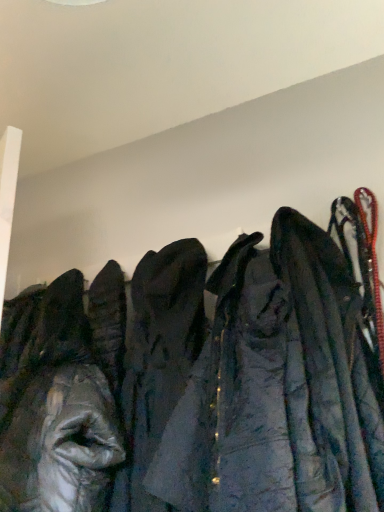
What is the approximate height of dark blue fabric coat at right, which is the 1th cloak in right-to-left order?

The height of dark blue fabric coat at right, which is the 1th cloak in right-to-left order, is 78.36 centimeters.

In the scene shown: In order to face dark gray fabric coat at center, which appears as the 1th cloak when viewed from the left, should I rotate leftwards or rightwards?

You should rotate left by 4.599 degrees.

Locate an element on the screen. This screenshot has width=384, height=512. dark blue fabric coat at right, which is counted as the second cloak, starting from the left is located at coordinates (332, 360).

Is point (314, 291) closer or farther from the camera than point (134, 367)?

Point (314, 291).

Based on the photo, how many degrees apart are the facing directions of dark blue fabric coat at right, which is the 1th cloak in right-to-left order, and dark gray fabric coat at center, which is the second cloak from right to left?

The angle between the facing direction of dark blue fabric coat at right, which is the 1th cloak in right-to-left order, and the facing direction of dark gray fabric coat at center, which is the second cloak from right to left, is 0.000334 degrees.

Is dark blue fabric coat at right, which is the 1th cloak in right-to-left order, aimed at dark gray fabric coat at center, which is the second cloak from right to left?

No.

Which of these two, dark blue fabric coat at right, which is counted as the second cloak, starting from the left, or dark gray fabric coat at center, which appears as the 1th cloak when viewed from the left, is bigger?

dark blue fabric coat at right, which is counted as the second cloak, starting from the left, is bigger.

Is dark blue fabric coat at right, which is the 1th cloak in right-to-left order, positioned beyond the bounds of shiny silver jacket at left?

That's correct, dark blue fabric coat at right, which is the 1th cloak in right-to-left order, is outside of shiny silver jacket at left.

How different are the orientations of dark blue fabric coat at right, which is counted as the second cloak, starting from the left, and shiny silver jacket at left in degrees?

The angular difference between dark blue fabric coat at right, which is counted as the second cloak, starting from the left, and shiny silver jacket at left is 0.000925 degrees.

From the image's perspective, is dark blue fabric coat at right, which is the 1th cloak in right-to-left order, on shiny silver jacket at left?

Yes.

Is dark blue fabric coat at right, which is counted as the second cloak, starting from the left, positioned with its back to shiny silver jacket at left?

dark blue fabric coat at right, which is counted as the second cloak, starting from the left, does not have its back to shiny silver jacket at left.

From the image's perspective, is shiny silver jacket at left located beneath dark blue fabric coat at right, which is the 1th cloak in right-to-left order?

Correct, shiny silver jacket at left appears lower than dark blue fabric coat at right, which is the 1th cloak in right-to-left order, in the image.

From a real-world perspective, is shiny silver jacket at left positioned above or below dark blue fabric coat at right, which is the 1th cloak in right-to-left order?

shiny silver jacket at left is situated lower than dark blue fabric coat at right, which is the 1th cloak in right-to-left order, in the real world.

Which is in front, shiny silver jacket at left or dark blue fabric coat at right, which is the 1th cloak in right-to-left order?

dark blue fabric coat at right, which is the 1th cloak in right-to-left order, is closer to the camera.

Is shiny silver jacket at left inside or outside of dark blue fabric coat at right, which is counted as the second cloak, starting from the left?

shiny silver jacket at left is not enclosed by dark blue fabric coat at right, which is counted as the second cloak, starting from the left.

Is dark gray fabric coat at center, which appears as the 1th cloak when viewed from the left, surrounding shiny silver jacket at left?

No, shiny silver jacket at left is not inside dark gray fabric coat at center, which appears as the 1th cloak when viewed from the left.

From a real-world perspective, is dark gray fabric coat at center, which appears as the 1th cloak when viewed from the left, physically above shiny silver jacket at left?

Actually, dark gray fabric coat at center, which appears as the 1th cloak when viewed from the left, is physically below shiny silver jacket at left in the real world.

Does dark gray fabric coat at center, which appears as the 1th cloak when viewed from the left, have a smaller size compared to shiny silver jacket at left?

Indeed, dark gray fabric coat at center, which appears as the 1th cloak when viewed from the left, has a smaller size compared to shiny silver jacket at left.

From their relative heights in the image, would you say dark gray fabric coat at center, which appears as the 1th cloak when viewed from the left, is taller or shorter than shiny silver jacket at left?

In the image, dark gray fabric coat at center, which appears as the 1th cloak when viewed from the left, appears to be shorter than shiny silver jacket at left.

Considering their positions, is dark gray fabric coat at center, which is the second cloak from right to left, located in front of or behind dark blue fabric coat at right, which is the 1th cloak in right-to-left order?

Visually, dark gray fabric coat at center, which is the second cloak from right to left, is located behind dark blue fabric coat at right, which is the 1th cloak in right-to-left order.

Consider the image. Which object is thinner, dark gray fabric coat at center, which appears as the 1th cloak when viewed from the left, or dark blue fabric coat at right, which is the 1th cloak in right-to-left order?

Thinner between the two is dark gray fabric coat at center, which appears as the 1th cloak when viewed from the left.

Are dark gray fabric coat at center, which appears as the 1th cloak when viewed from the left, and dark blue fabric coat at right, which is counted as the second cloak, starting from the left, far apart?

No, dark gray fabric coat at center, which appears as the 1th cloak when viewed from the left, is in close proximity to dark blue fabric coat at right, which is counted as the second cloak, starting from the left.

Which point is more forward, (70, 416) or (162, 325)?

The point (70, 416) is in front.

Can you confirm if shiny silver jacket at left is shorter than dark gray fabric coat at center, which appears as the 1th cloak when viewed from the left?

No, shiny silver jacket at left is not shorter than dark gray fabric coat at center, which appears as the 1th cloak when viewed from the left.

Is shiny silver jacket at left touching dark gray fabric coat at center, which appears as the 1th cloak when viewed from the left?

No, shiny silver jacket at left is not next to dark gray fabric coat at center, which appears as the 1th cloak when viewed from the left.

Identify the location of cloak beneath the dark blue fabric coat at right, which is the 1th cloak in right-to-left order (from a real-world perspective). This screenshot has height=512, width=384. (158, 359).

From the image's perspective, starting from the shiny silver jacket at left, which cloak is the 2nd one above? Please provide its 2D coordinates.

[(332, 360)]

Estimate the real-world distances between objects in this image. Which object is closer to shiny silver jacket at left, dark gray fabric coat at center, which is the second cloak from right to left, or dark blue fabric coat at right, which is counted as the second cloak, starting from the left?

dark gray fabric coat at center, which is the second cloak from right to left, is positioned closer to the anchor shiny silver jacket at left.

From the image, which object appears to be farther from dark blue fabric coat at right, which is counted as the second cloak, starting from the left, shiny silver jacket at left or dark gray fabric coat at center, which is the second cloak from right to left?

The object further to dark blue fabric coat at right, which is counted as the second cloak, starting from the left, is shiny silver jacket at left.

Which object lies further to the anchor point dark gray fabric coat at center, which appears as the 1th cloak when viewed from the left, shiny silver jacket at left or dark blue fabric coat at right, which is the 1th cloak in right-to-left order?

dark blue fabric coat at right, which is the 1th cloak in right-to-left order, lies further to dark gray fabric coat at center, which appears as the 1th cloak when viewed from the left, than the other object.

Which object lies nearer to the anchor point shiny silver jacket at left, dark blue fabric coat at right, which is counted as the second cloak, starting from the left, or dark gray fabric coat at center, which is the second cloak from right to left?

dark gray fabric coat at center, which is the second cloak from right to left, is closer to shiny silver jacket at left.

Considering their positions, is dark gray fabric coat at center, which is the second cloak from right to left, positioned further to dark blue fabric coat at right, which is counted as the second cloak, starting from the left, than shiny silver jacket at left?

shiny silver jacket at left lies further to dark blue fabric coat at right, which is counted as the second cloak, starting from the left, than the other object.

Estimate the real-world distances between objects in this image. Which object is further from dark gray fabric coat at center, which is the second cloak from right to left, dark blue fabric coat at right, which is counted as the second cloak, starting from the left, or shiny silver jacket at left?

dark blue fabric coat at right, which is counted as the second cloak, starting from the left, is positioned further to the anchor dark gray fabric coat at center, which is the second cloak from right to left.

Locate an element on the screen. cloak located between shiny silver jacket at left and dark blue fabric coat at right, which is the 1th cloak in right-to-left order, in the left-right direction is located at coordinates (158, 359).